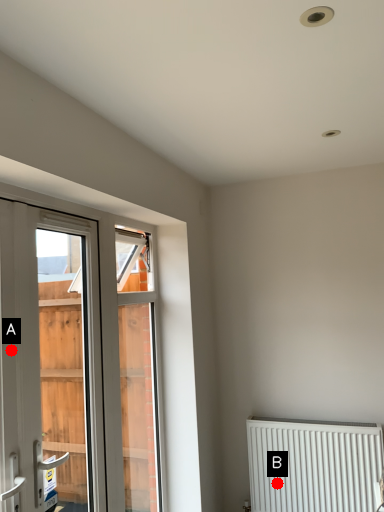
Question: Two points are circled on the image, labeled by A and B beside each circle. Which point appears closest to the camera in this image?

Choices:
 (A) A is closer
 (B) B is closer

Answer: (A)